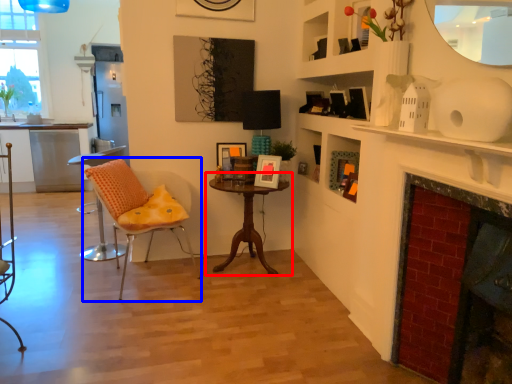
Question: Which of the following is the closest to the observer, table (highlighted by a red box) or chair (highlighted by a blue box)?

Choices:
 (A) table
 (B) chair

Answer: (B)